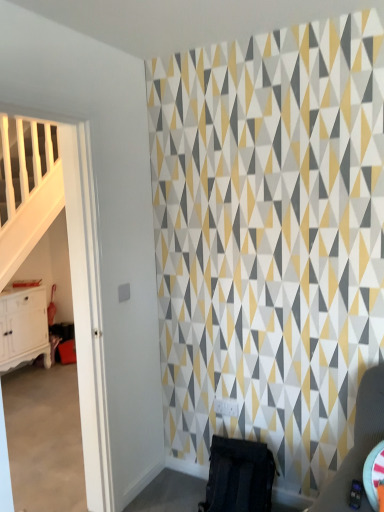
Question: Does black fabric swivel chair at lower center have a greater width compared to white glossy cabinet at left?

Choices:
 (A) yes
 (B) no

Answer: (A)

Question: Would you consider black fabric swivel chair at lower center to be distant from white glossy cabinet at left?

Choices:
 (A) no
 (B) yes

Answer: (B)

Question: Is black fabric swivel chair at lower center located outside white glossy cabinet at left?

Choices:
 (A) no
 (B) yes

Answer: (B)

Question: Is black fabric swivel chair at lower center oriented towards white glossy cabinet at left?

Choices:
 (A) yes
 (B) no

Answer: (B)

Question: Is black fabric swivel chair at lower center bigger than white glossy cabinet at left?

Choices:
 (A) yes
 (B) no

Answer: (B)

Question: Considering the relative sizes of black fabric swivel chair at lower center and white glossy cabinet at left in the image provided, is black fabric swivel chair at lower center shorter than white glossy cabinet at left?

Choices:
 (A) yes
 (B) no

Answer: (A)

Question: Considering the relative sizes of white glossy cabinet at left and black fabric swivel chair at lower center in the image provided, is white glossy cabinet at left thinner than black fabric swivel chair at lower center?

Choices:
 (A) yes
 (B) no

Answer: (A)

Question: Does white glossy cabinet at left appear on the right side of black fabric swivel chair at lower center?

Choices:
 (A) no
 (B) yes

Answer: (A)

Question: Is white glossy cabinet at left facing away from black fabric swivel chair at lower center?

Choices:
 (A) no
 (B) yes

Answer: (A)

Question: Is white glossy cabinet at left next to black fabric swivel chair at lower center?

Choices:
 (A) yes
 (B) no

Answer: (B)

Question: Does white glossy cabinet at left have a greater height compared to black fabric swivel chair at lower center?

Choices:
 (A) yes
 (B) no

Answer: (A)

Question: From the image's perspective, does white glossy cabinet at left appear higher than black fabric swivel chair at lower center?

Choices:
 (A) yes
 (B) no

Answer: (A)

Question: Looking at their shapes, would you say black fabric swivel chair at lower center is wider or thinner than white glossy cabinet at left?

Choices:
 (A) thin
 (B) wide

Answer: (B)